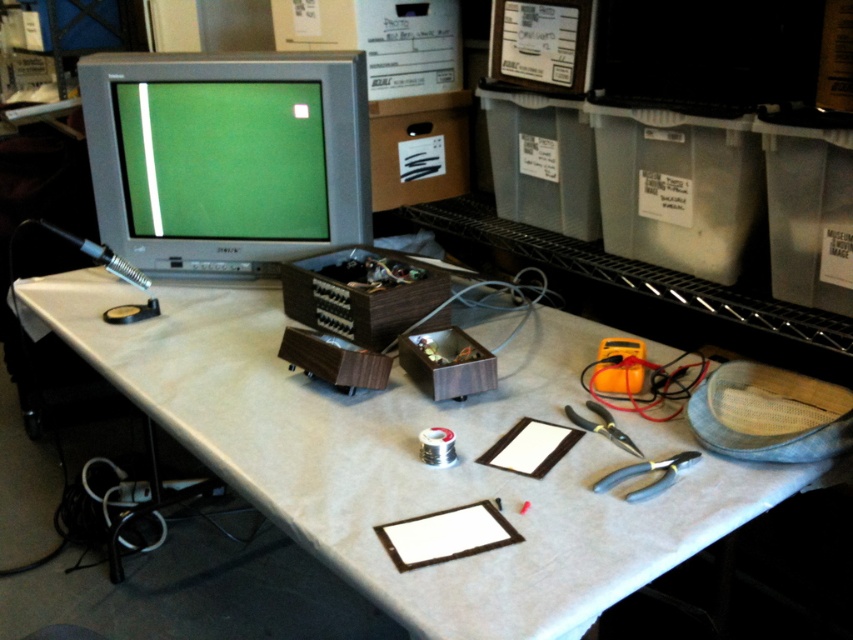
What do you see at coordinates (409, 456) in the screenshot? I see `white matte computer desk at center` at bounding box center [409, 456].

The height and width of the screenshot is (640, 853). Identify the location of white matte computer desk at center. (409, 456).

Which is below, matte gray monitor at upper left or black plastic pliers at lower right?

black plastic pliers at lower right

Does point (138, 228) lie behind point (618, 483)?

Yes, point (138, 228) is behind point (618, 483).

Where is `matte gray monitor at upper left`? Image resolution: width=853 pixels, height=640 pixels. matte gray monitor at upper left is located at coordinates (225, 157).

Is matte gray monitor at upper left positioned before black metal pliers at center?

No, matte gray monitor at upper left is further to the viewer.

Does matte gray monitor at upper left lie behind black metal pliers at center?

Yes, matte gray monitor at upper left is further from the viewer.

What do you see at coordinates (225, 157) in the screenshot? I see `matte gray monitor at upper left` at bounding box center [225, 157].

The height and width of the screenshot is (640, 853). What are the coordinates of `matte gray monitor at upper left` in the screenshot? It's located at (225, 157).